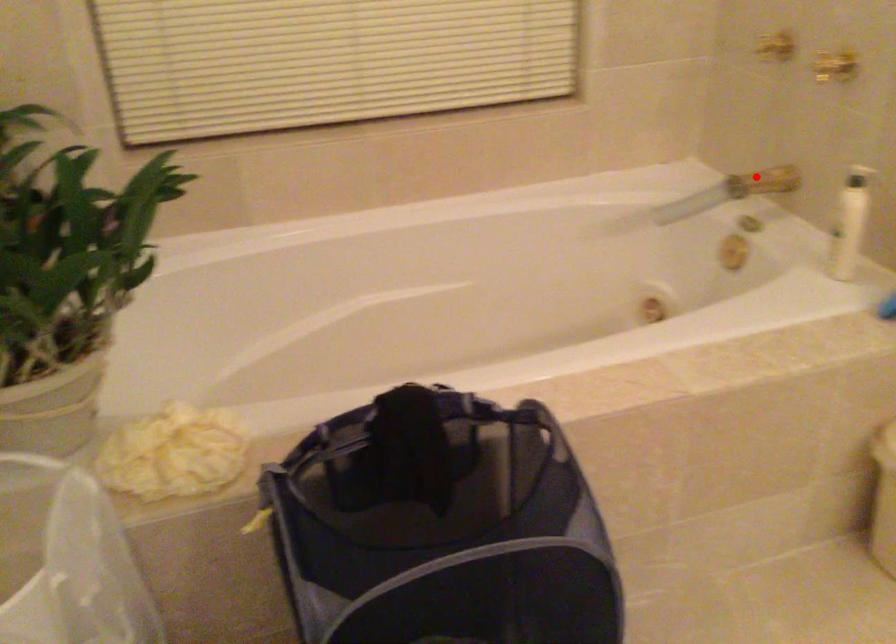
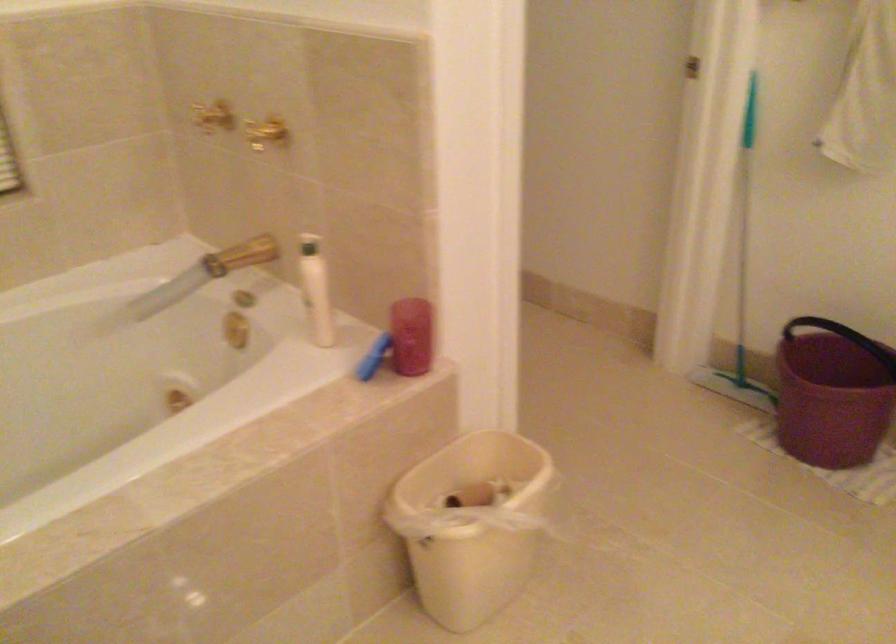
The point at the highlighted location is marked in the first image. Where is the corresponding point in the second image?

(240, 254)